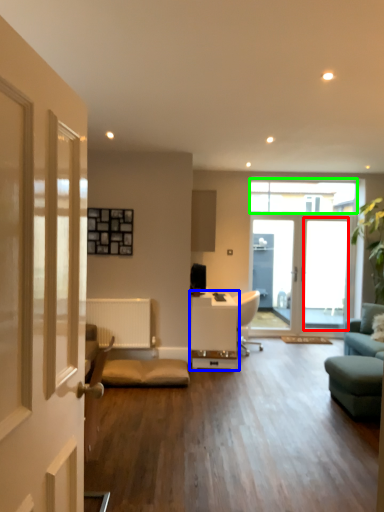
Question: Estimate the real-world distances between objects in this image. Which object is closer to window screen (highlighted by a red box), table (highlighted by a blue box) or window (highlighted by a green box)?

Choices:
 (A) table
 (B) window

Answer: (B)